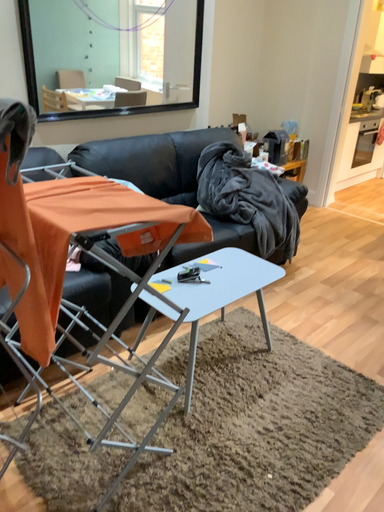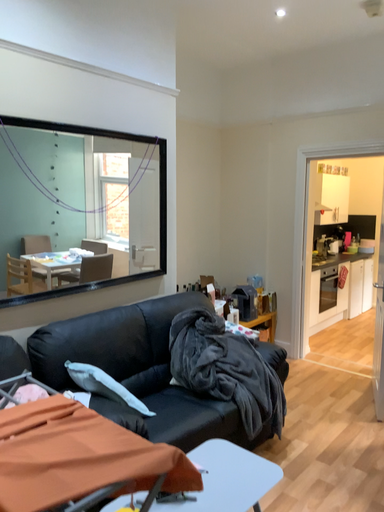
Question: Which way did the camera rotate in the video?

Choices:
 (A) rotated upward
 (B) rotated downward

Answer: (A)